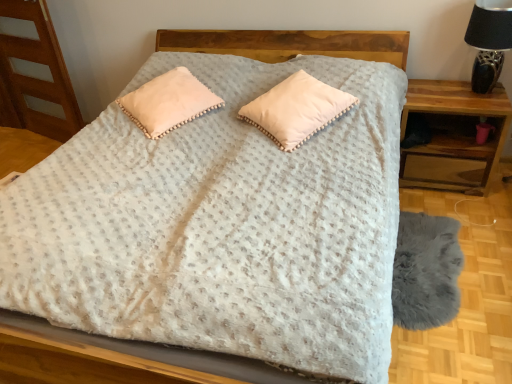
The image size is (512, 384). Identify the location of blank area beneath black ceramic table lamp at upper right (from a real-world perspective). (480, 95).